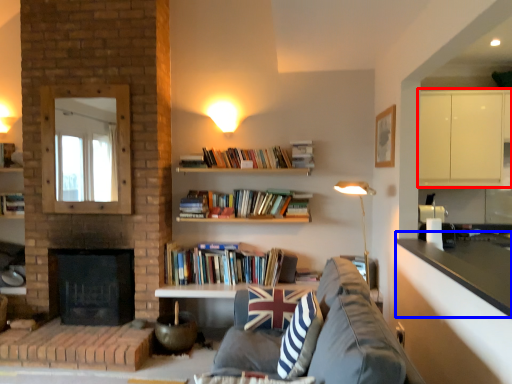
Question: Which object is closer to the camera taking this photo, cabinetry (highlighted by a red box) or counter top (highlighted by a blue box)?

Choices:
 (A) cabinetry
 (B) counter top

Answer: (B)